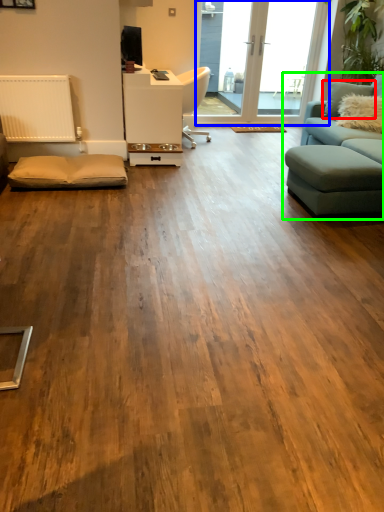
Question: Based on their relative distances, which object is nearer to pillow (highlighted by a red box)? Choose from window screen (highlighted by a blue box) and studio couch (highlighted by a green box).

Choices:
 (A) window screen
 (B) studio couch

Answer: (A)